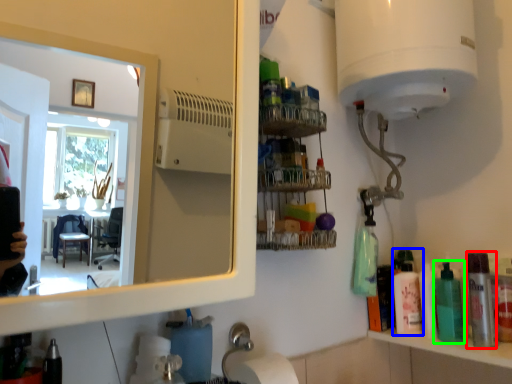
Question: Which object is the farthest from mouthwash (highlighted by a red box)? Choose among these: toiletry (highlighted by a blue box) or mouthwash (highlighted by a green box).

Choices:
 (A) toiletry
 (B) mouthwash

Answer: (A)